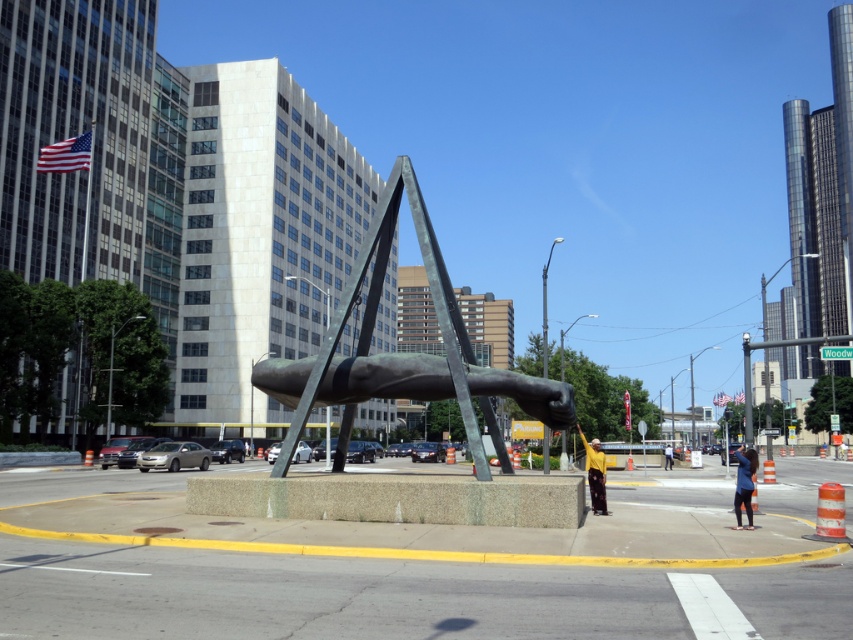
Question: Which point appears closest to the camera in this image?

Choices:
 (A) (601, 481)
 (B) (672, 465)

Answer: (A)

Question: Among these points, which one is farthest from the camera?

Choices:
 (A) (444, 362)
 (B) (596, 504)
 (C) (744, 493)

Answer: (B)

Question: Is bronze sculpture at center to the left of yellow matte shirt at center from the viewer's perspective?

Choices:
 (A) yes
 (B) no

Answer: (A)

Question: Which point appears farthest from the camera in this image?

Choices:
 (A) (668, 452)
 (B) (741, 499)
 (C) (485, 376)
 (D) (601, 499)

Answer: (A)

Question: Does yellow matte shirt at center lie behind dark blue jeans at center?

Choices:
 (A) no
 (B) yes

Answer: (A)

Question: Is yellow matte shirt at center smaller than dark blue jeans at center?

Choices:
 (A) yes
 (B) no

Answer: (A)